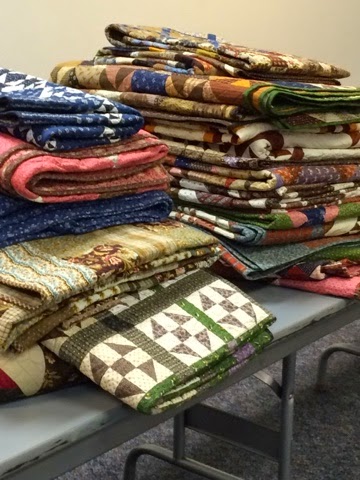
What are the coordinates of `metal bar underneath table` in the screenshot? It's located at (285, 429), (175, 438), (152, 449), (341, 346), (271, 381).